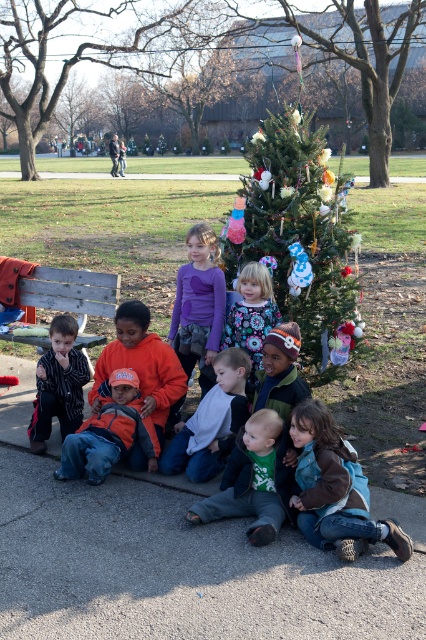
You are a photographer trying to capture a photo of the brown fuzzy jacket at lower right and the green matte shirt at center. The camera you are using has a maximum focus range of 12 inches. Can you fit both subjects within the camera focus range?

The brown fuzzy jacket at lower right and green matte shirt at center are 11.96 inches apart from each other. Since the distance between them is less than the camera maximum focus range of 12 inches, both subjects can be captured within the camera focus range.

You are a photographer trying to capture a group photo of the children. You notice the white cotton shirt at center and the striped cotton shirt at left. Which child should you ask to move slightly to avoid overlapping their shirts?

You should ask the striped cotton shirt at left to move slightly to the right, as the white cotton shirt at center is positioned under it and might be obscured in the photo.

You are a photographer standing at the center of the scene. You want to take a photo of the white cotton shirt at center. Where should you aim your camera to capture it?

You should aim your camera at the point with coordinates 0.661 in the x axis and 0.495 in the y axis to capture the white cotton shirt at center.